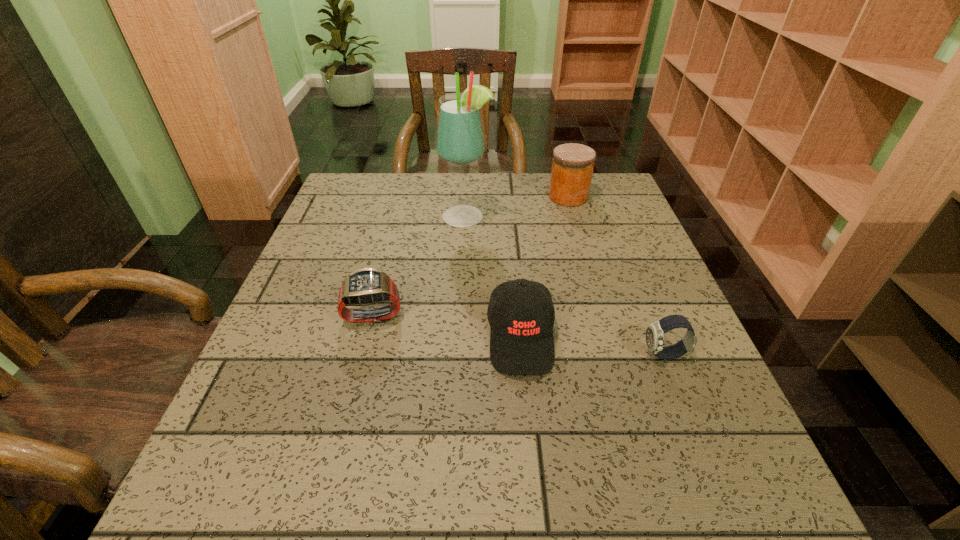
Where is `free space located 0.200m on the face of the nearer watch`? The height and width of the screenshot is (540, 960). free space located 0.200m on the face of the nearer watch is located at coordinates [x=537, y=355].

At what (x,y) coordinates should I click in order to perform the action: click on free space located on the face of the nearer watch. Please return your answer as a coordinate pair (x, y). Looking at the image, I should click on (499, 355).

This screenshot has height=540, width=960. Find the location of `free region located on the face of the nearer watch`. free region located on the face of the nearer watch is located at coordinates (601, 355).

The height and width of the screenshot is (540, 960). I want to click on alcohol at the far edge, so click(x=460, y=140).

Locate an element on the screen. jar present at the far edge is located at coordinates (572, 168).

What are the coordinates of `object at the left edge` in the screenshot? It's located at (367, 286).

The image size is (960, 540). In order to click on jar present at the right edge in this screenshot , I will do `click(572, 168)`.

The image size is (960, 540). Identify the location of watch at the right edge. (655, 332).

At what (x,y) coordinates should I click in order to perform the action: click on object that is at the far right corner. Please return your answer as a coordinate pair (x, y). Looking at the image, I should click on (572, 168).

Where is `free spot at the far edge of the desktop`? free spot at the far edge of the desktop is located at coordinates (423, 179).